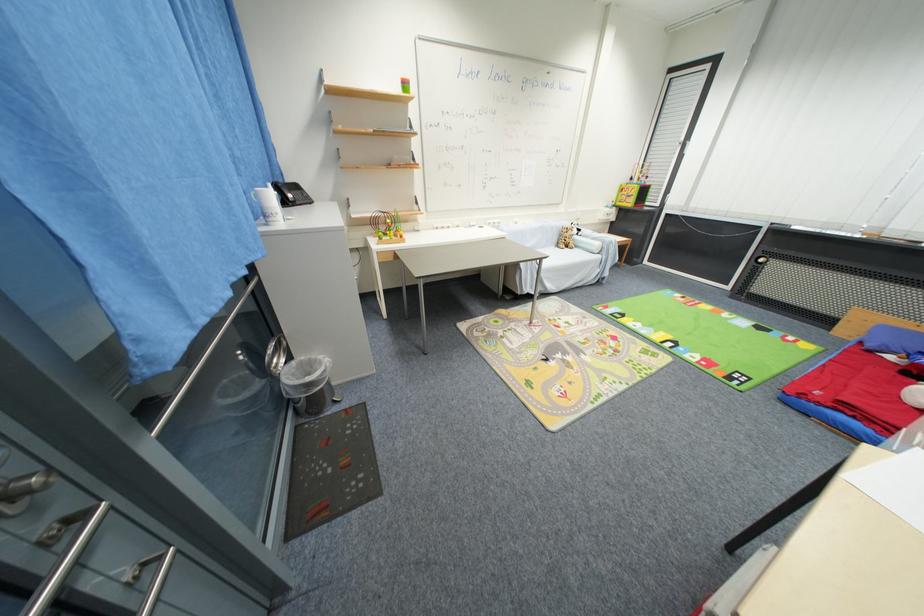
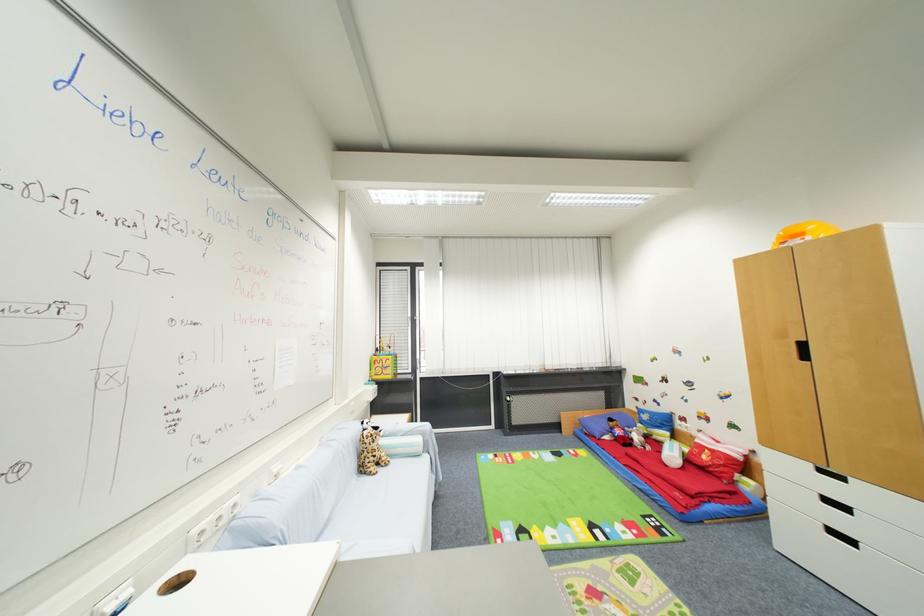
Locate, in the second image, the point that corresponds to pixel 572 251 in the first image.

(385, 472)